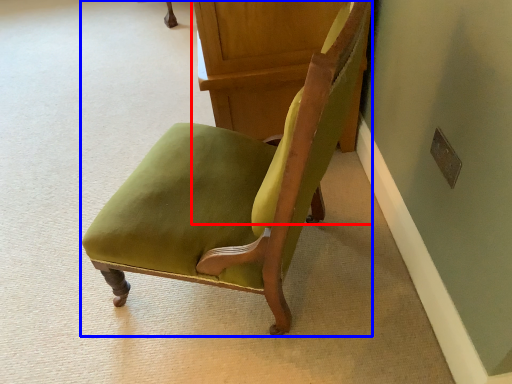
Question: Which object is closer to the camera taking this photo, furniture (highlighted by a red box) or chair (highlighted by a blue box)?

Choices:
 (A) furniture
 (B) chair

Answer: (B)